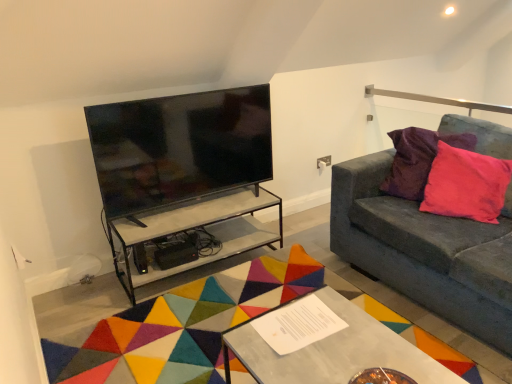
Locate an element on the screen. This screenshot has height=384, width=512. free spot below white paper at center (from a real-world perspective) is located at coordinates (292, 321).